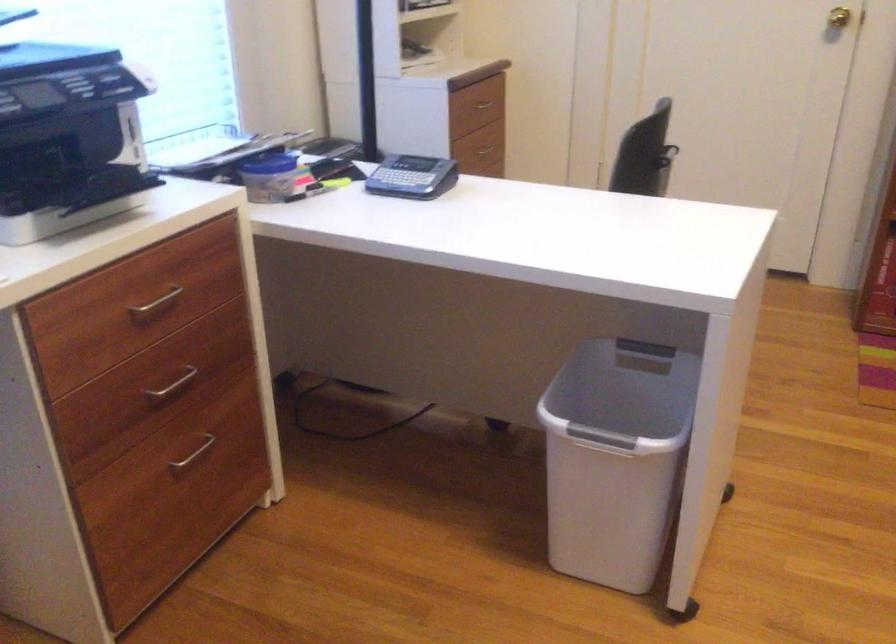
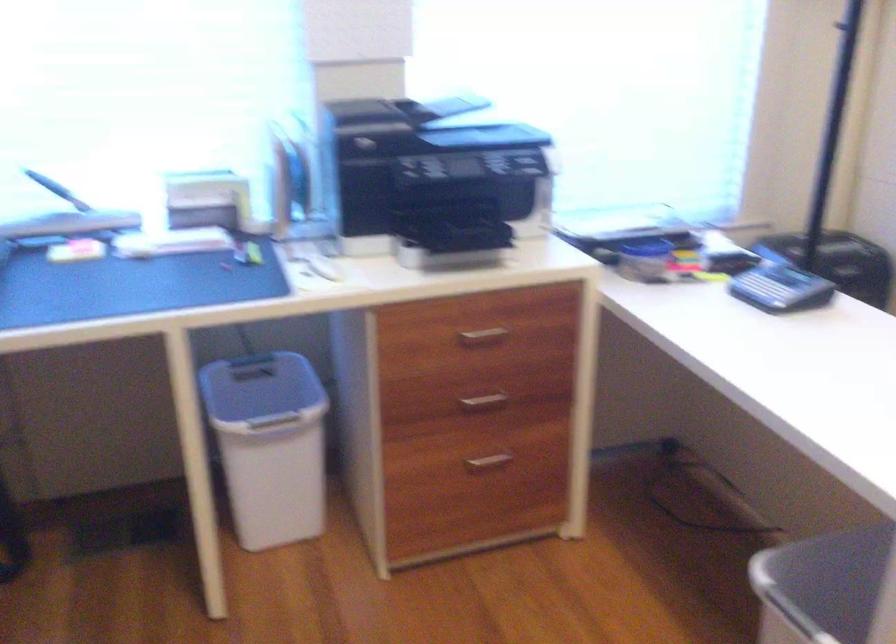
Where in the second image is the point corresponding to the point at 407,176 from the first image?

(763, 289)